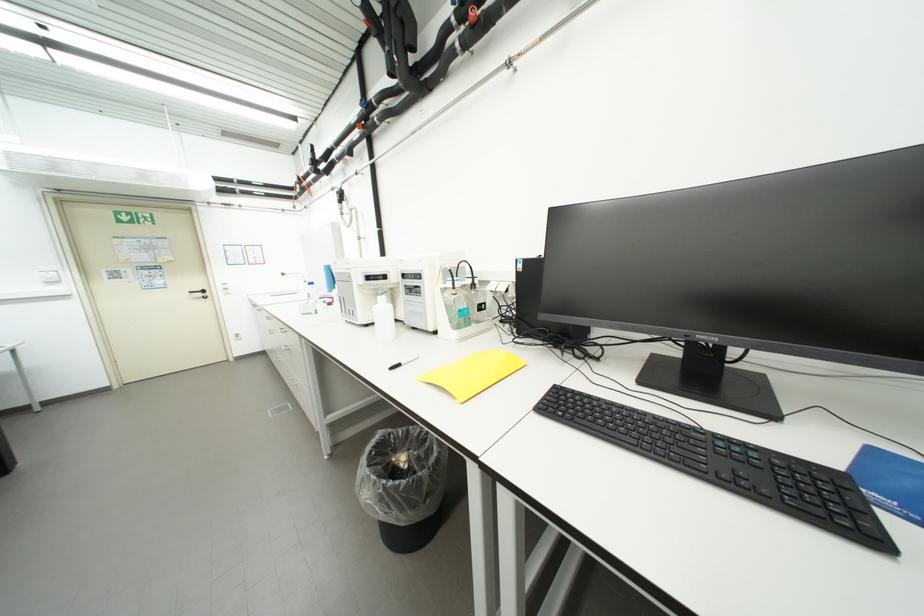
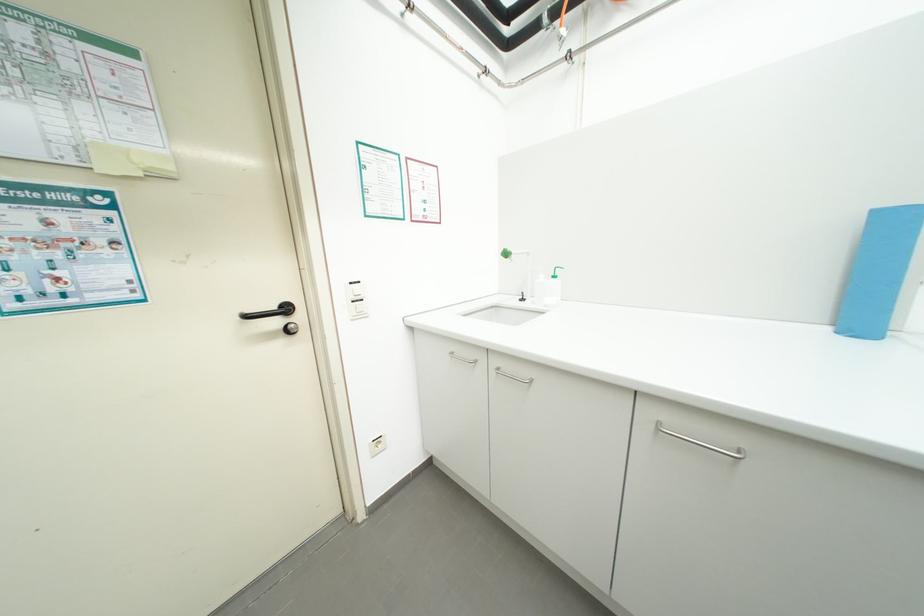
Where in the second image is the point corresponding to the point at 228,293 from the first image?

(351, 312)